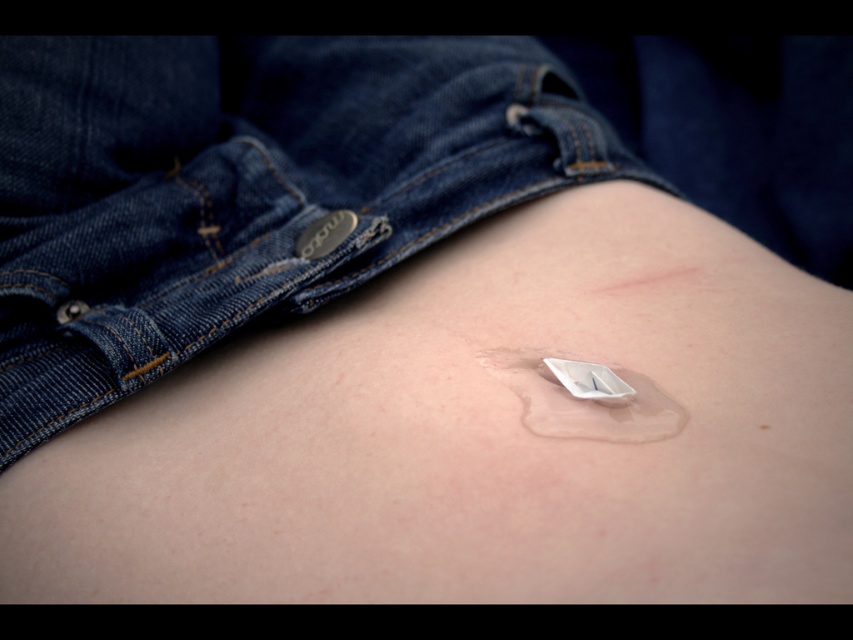
Is denim at center closer to the viewer compared to white matte patch at center?

No.

Is denim at center smaller than white matte patch at center?

No.

Describe the element at coordinates (244, 188) in the screenshot. I see `denim at center` at that location.

The image size is (853, 640). What are the coordinates of `denim at center` in the screenshot? It's located at (244, 188).